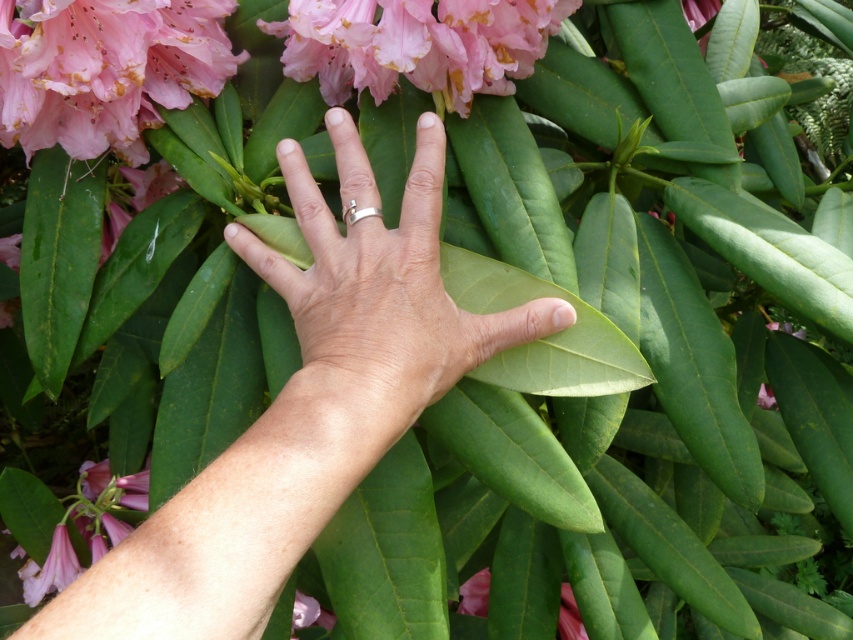
Is satin gold ring at center bigger than matte pink petals at upper left?

Indeed, satin gold ring at center has a larger size compared to matte pink petals at upper left.

Who is more forward, [440,316] or [10,51]?

Positioned in front is point [440,316].

Locate an element on the screen. The image size is (853, 640). satin gold ring at center is located at coordinates (384, 260).

Which is behind, point (244, 589) or point (514, 8)?

The point (514, 8) is behind.

Who is positioned more to the left, skinny silver ring at center or pink glossy flower at upper center?

skinny silver ring at center

Image resolution: width=853 pixels, height=640 pixels. In order to click on skinny silver ring at center in this screenshot , I will do `click(305, 406)`.

Between satin gold ring at center and matte pink flower at center, which one is positioned higher?

Positioned higher is satin gold ring at center.

In the scene shown: Is satin gold ring at center further to camera compared to matte pink flower at center?

No.

Where is `satin gold ring at center`? satin gold ring at center is located at coordinates (384, 260).